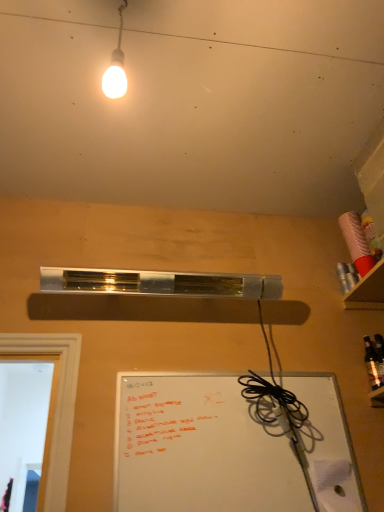
Question: Is cardboard shelf at upper right positioned in front of whiteboard at lower right?

Choices:
 (A) no
 (B) yes

Answer: (A)

Question: Can you confirm if cardboard shelf at upper right is positioned to the left of whiteboard at lower right?

Choices:
 (A) no
 (B) yes

Answer: (A)

Question: Does cardboard shelf at upper right have a greater height compared to whiteboard at lower right?

Choices:
 (A) no
 (B) yes

Answer: (A)

Question: Is cardboard shelf at upper right to the right of whiteboard at lower right from the viewer's perspective?

Choices:
 (A) yes
 (B) no

Answer: (A)

Question: Would you consider cardboard shelf at upper right to be distant from whiteboard at lower right?

Choices:
 (A) yes
 (B) no

Answer: (B)

Question: Is cardboard shelf at upper right smaller than whiteboard at lower right?

Choices:
 (A) yes
 (B) no

Answer: (A)

Question: Is whiteboard at lower right positioned behind shiny dark glass bottle at right?

Choices:
 (A) no
 (B) yes

Answer: (A)

Question: Can you confirm if whiteboard at lower right is smaller than shiny dark glass bottle at right?

Choices:
 (A) no
 (B) yes

Answer: (A)

Question: Is whiteboard at lower right to the left of shiny dark glass bottle at right from the viewer's perspective?

Choices:
 (A) yes
 (B) no

Answer: (A)

Question: Does whiteboard at lower right appear on the right side of shiny dark glass bottle at right?

Choices:
 (A) no
 (B) yes

Answer: (A)

Question: Is whiteboard at lower right in contact with shiny dark glass bottle at right?

Choices:
 (A) yes
 (B) no

Answer: (B)

Question: Is whiteboard at lower right not close to shiny dark glass bottle at right?

Choices:
 (A) yes
 (B) no

Answer: (B)

Question: Does cardboard shelf at upper right come behind shiny dark glass bottle at right?

Choices:
 (A) yes
 (B) no

Answer: (B)